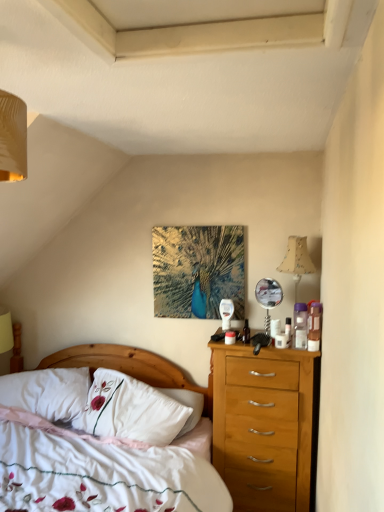
Question: Is white cotton bed at center to the left of white soft pillow at lower left, the second pillow viewed from the right, from the viewer's perspective?

Choices:
 (A) yes
 (B) no

Answer: (B)

Question: Is white cotton bed at center in front of white soft pillow at lower left, which is the first pillow in left-to-right order?

Choices:
 (A) no
 (B) yes

Answer: (B)

Question: From a real-world perspective, is white cotton bed at center located higher than white soft pillow at lower left, which is the first pillow in left-to-right order?

Choices:
 (A) yes
 (B) no

Answer: (B)

Question: From the image's perspective, is white cotton bed at center on top of white soft pillow at lower left, the second pillow viewed from the right?

Choices:
 (A) no
 (B) yes

Answer: (A)

Question: Does white cotton bed at center have a lesser width compared to white soft pillow at lower left, the second pillow viewed from the right?

Choices:
 (A) no
 (B) yes

Answer: (A)

Question: Could you tell me if white cotton bed at center is turned towards white soft pillow at lower left, the second pillow viewed from the right?

Choices:
 (A) no
 (B) yes

Answer: (A)

Question: Is white soft pillow at lower left, which is the first pillow in left-to-right order, shorter than white embroidered pillow at center, the first pillow viewed from the right?

Choices:
 (A) no
 (B) yes

Answer: (B)

Question: Can you confirm if white soft pillow at lower left, the second pillow viewed from the right, is thinner than white embroidered pillow at center, the first pillow viewed from the right?

Choices:
 (A) yes
 (B) no

Answer: (B)

Question: Is white soft pillow at lower left, which is the first pillow in left-to-right order, closer to camera compared to white embroidered pillow at center, acting as the second pillow starting from the left?

Choices:
 (A) no
 (B) yes

Answer: (A)

Question: From the image's perspective, is white soft pillow at lower left, the second pillow viewed from the right, over white embroidered pillow at center, acting as the second pillow starting from the left?

Choices:
 (A) yes
 (B) no

Answer: (B)

Question: From a real-world perspective, does white soft pillow at lower left, which is the first pillow in left-to-right order, stand above white embroidered pillow at center, acting as the second pillow starting from the left?

Choices:
 (A) no
 (B) yes

Answer: (A)

Question: Is white soft pillow at lower left, the second pillow viewed from the right, smaller than white embroidered pillow at center, acting as the second pillow starting from the left?

Choices:
 (A) no
 (B) yes

Answer: (B)

Question: Considering the relative positions of white cotton bed at center and white embroidered pillow at center, acting as the second pillow starting from the left, in the image provided, is white cotton bed at center to the right of white embroidered pillow at center, acting as the second pillow starting from the left, from the viewer's perspective?

Choices:
 (A) yes
 (B) no

Answer: (B)